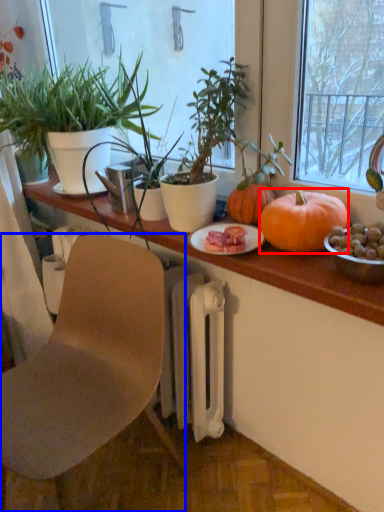
Question: Which object appears closest to the camera in this image, pumpkin (highlighted by a red box) or chair (highlighted by a blue box)?

Choices:
 (A) pumpkin
 (B) chair

Answer: (B)